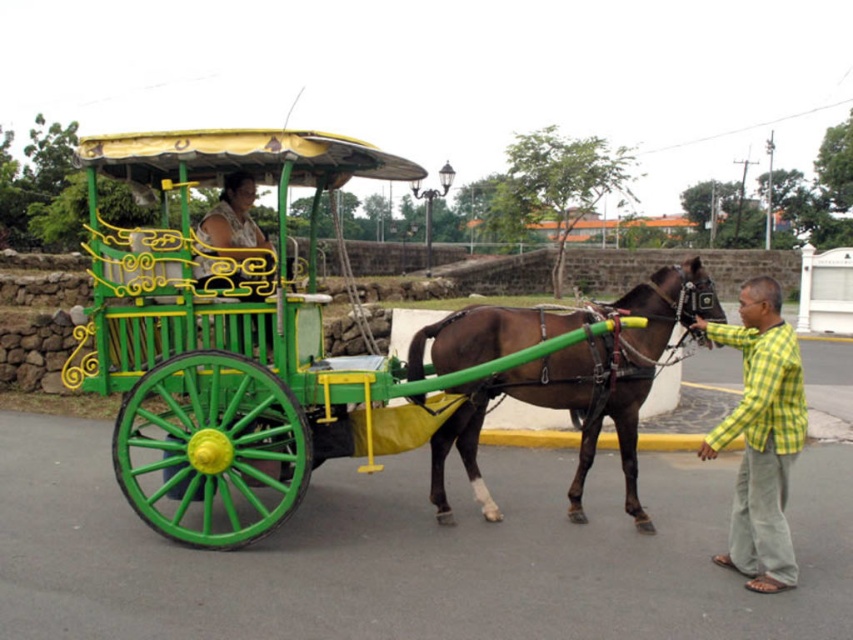
You are standing at the point labeled point (172, 376) and want to walk to the point labeled point (753, 380). Given the scene described, will you have an unobstructed path directly towards your destination?

The path between point (172, 376) and point (753, 380) is obstructed because point (172, 376) is behind point (753, 380), meaning the latter would block the direct route.

You are standing at the center of the image. A green polished wood horse cart is located at coordinates point 0.544, 0.372. If you move 0.1 units to the right along the x axis, will you be closer to the green polished wood horse cart at center?

Moving 0.1 units to the right along the x axis from the center would take you to x coordinate 0.5, which is closer to the green polished wood horse cart at center at x coordinate 0.544. Therefore, yes, you will be closer.

You are a passenger sitting in the green polished wood horse cart at center. You want to pat the brown glossy horse at center. Can you reach the horse from your current position?

The green polished wood horse cart at center is above the brown glossy horse at center, so you can reach the horse by leaning forward or stepping down from the cart.